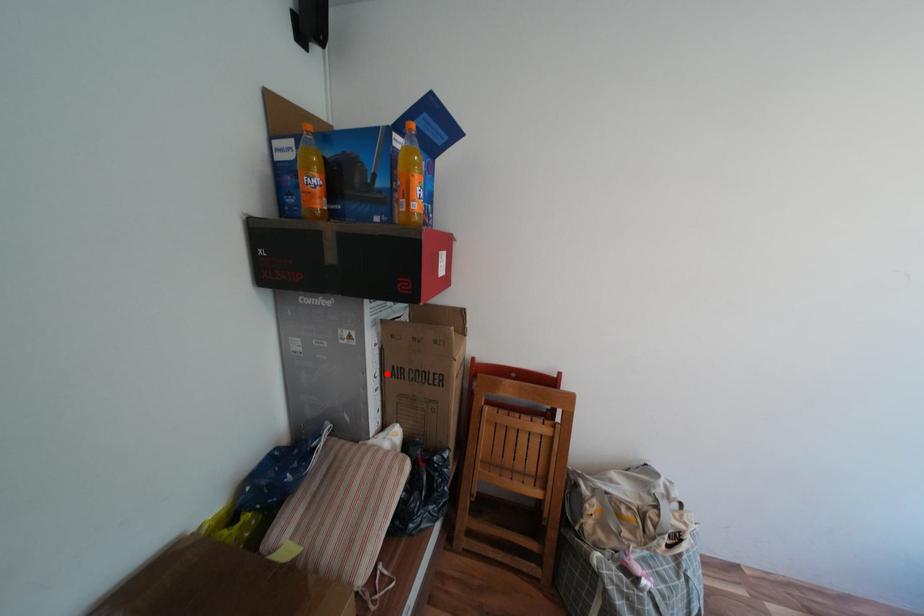
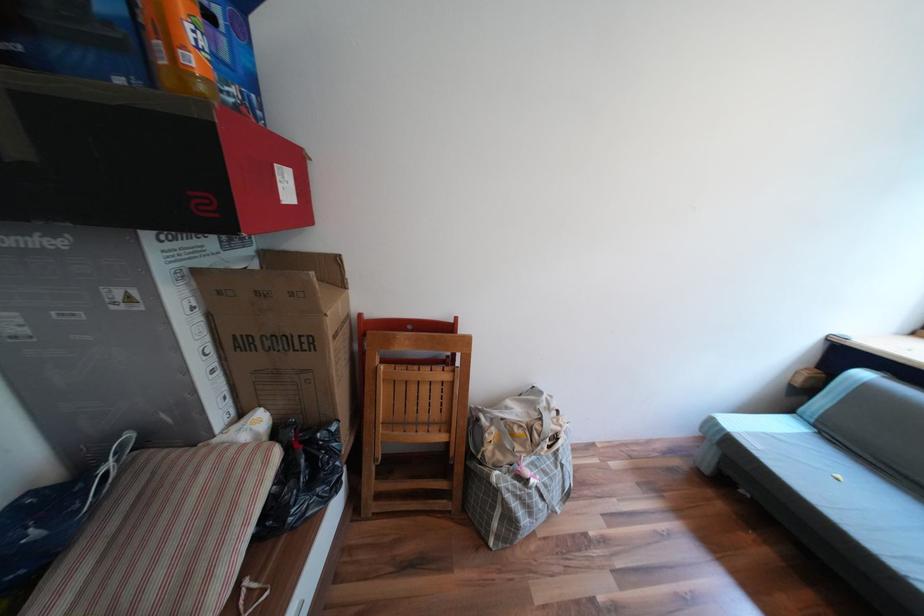
The point at the highlighted location is marked in the first image. Where is the corresponding point in the second image?

(219, 349)